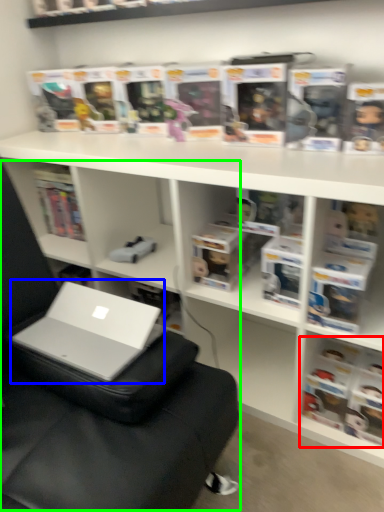
Question: Which object is positioned farthest from book (highlighted by a red box)? Select from laptop (highlighted by a blue box) and bean bag chair (highlighted by a green box).

Choices:
 (A) laptop
 (B) bean bag chair

Answer: (A)